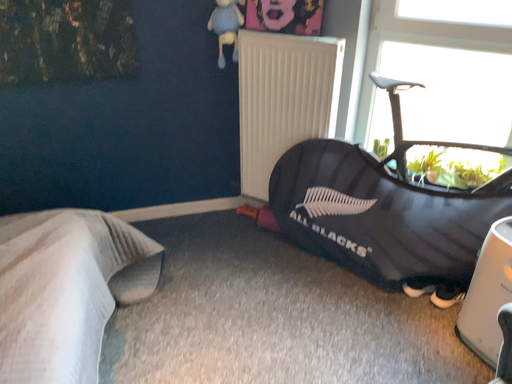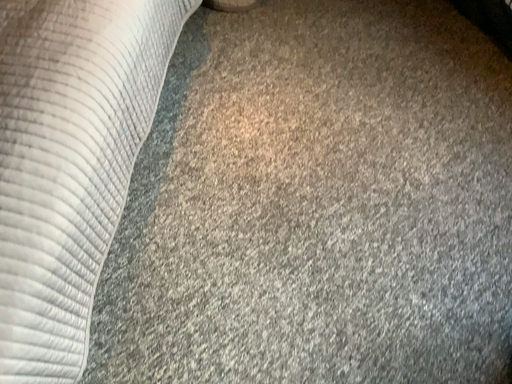
Question: How did the camera likely rotate when shooting the video?

Choices:
 (A) rotated left
 (B) rotated right

Answer: (A)